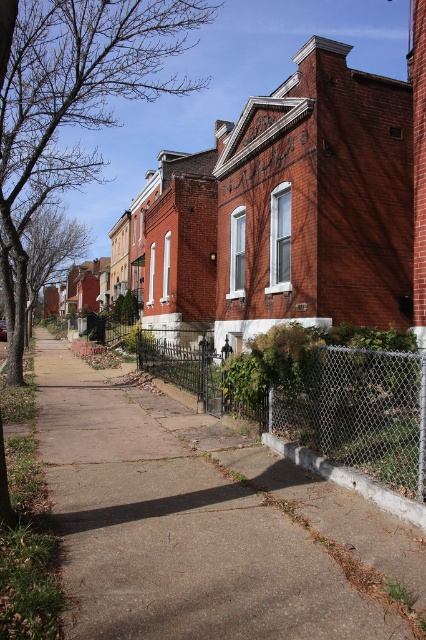
Question: Which of the following is the farthest from the observer?

Choices:
 (A) (339, 422)
 (B) (100, 488)

Answer: (A)

Question: Does concrete sidewalk at center have a greater width compared to chain-link fence at center?

Choices:
 (A) yes
 (B) no

Answer: (B)

Question: Does concrete sidewalk at center have a greater width compared to chain-link fence at center?

Choices:
 (A) yes
 (B) no

Answer: (B)

Question: Is concrete sidewalk at center wider than chain-link fence at center?

Choices:
 (A) no
 (B) yes

Answer: (A)